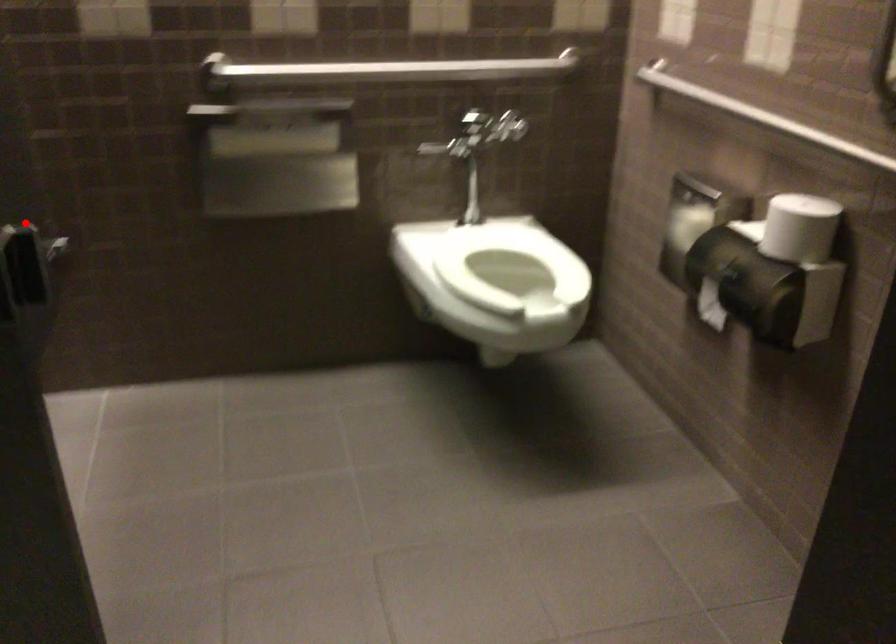
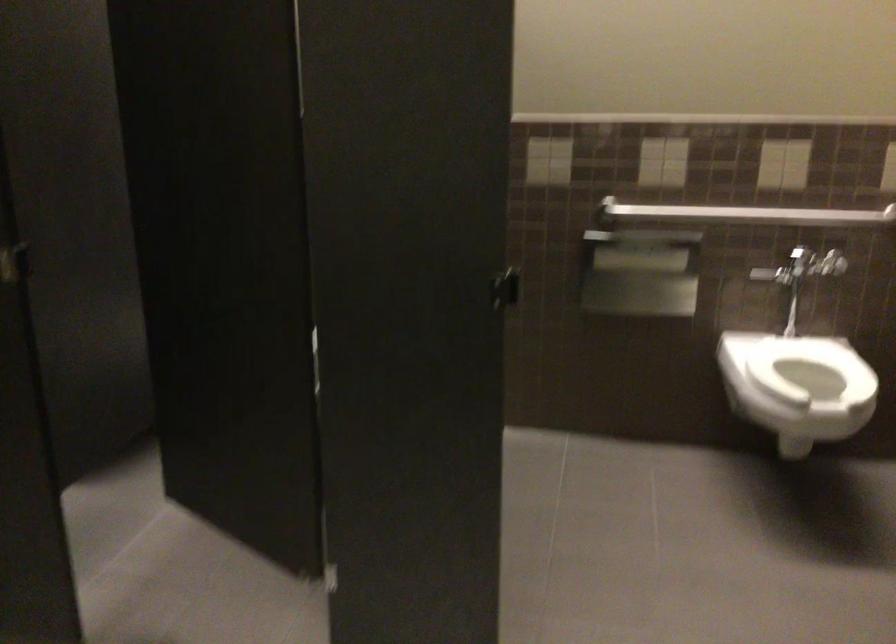
Question: I am providing you with two images of the same scene from different viewpoints. A red point is marked on the first image. Can you still see the location of the red point in image 2?

Choices:
 (A) Yes
 (B) No

Answer: (B)